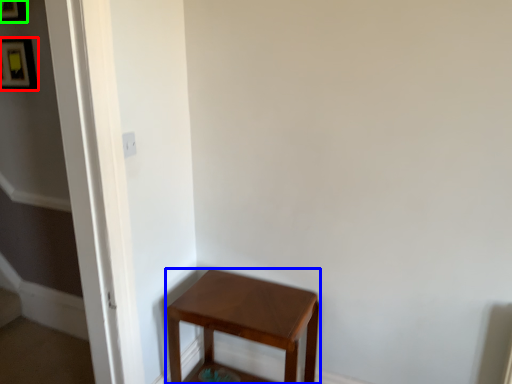
Question: Which is farther away from picture frame (highlighted by a red box)? stool (highlighted by a blue box) or picture frame (highlighted by a green box)?

Choices:
 (A) stool
 (B) picture frame

Answer: (A)